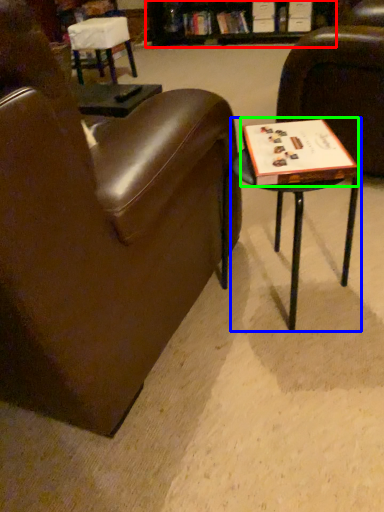
Question: Based on their relative distances, which object is nearer to bookshelf (highlighted by a red box)? Choose from table (highlighted by a blue box) and paperback book (highlighted by a green box).

Choices:
 (A) table
 (B) paperback book

Answer: (A)